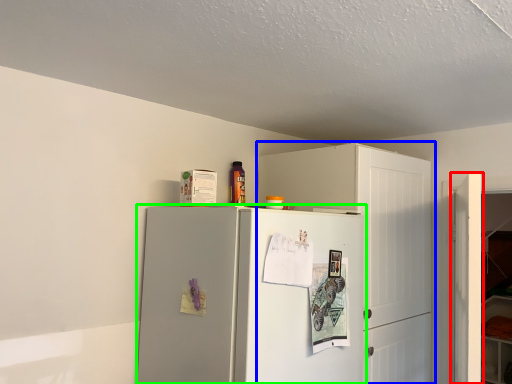
Question: Considering the real-world distances, which object is closest to door (highlighted by a red box)? cabinetry (highlighted by a blue box) or refrigerator (highlighted by a green box).

Choices:
 (A) cabinetry
 (B) refrigerator

Answer: (A)